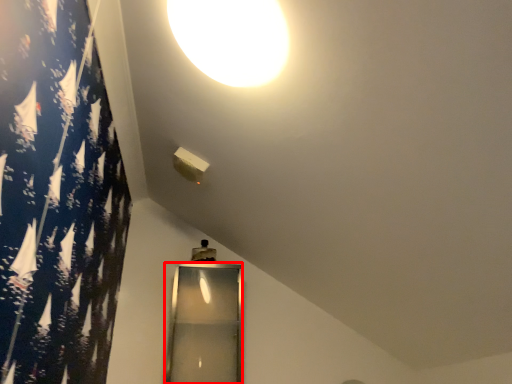
Question: In this image, where is glass door (annotated by the red box) located relative to lamp?

Choices:
 (A) right
 (B) left

Answer: (B)